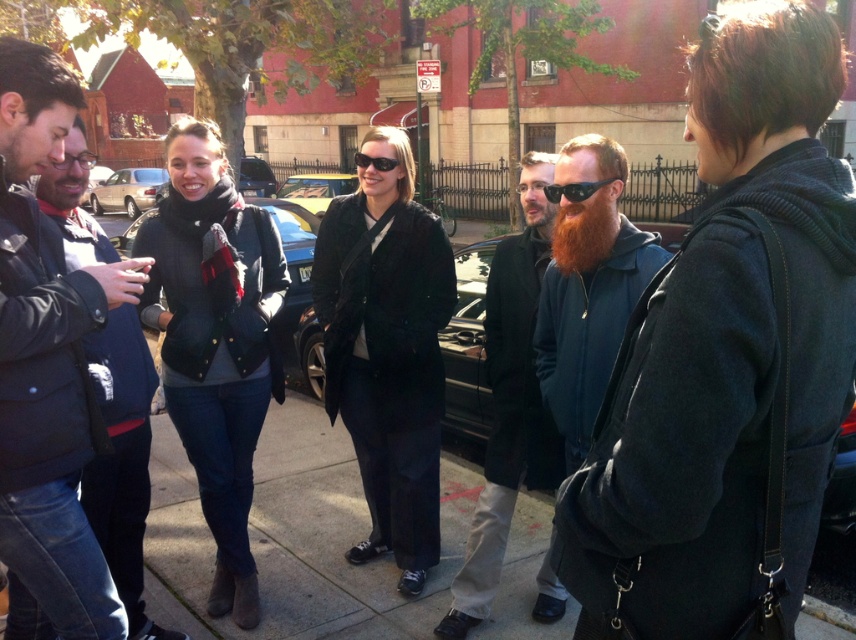
Based on the photo, does gray concrete sidewalk at center have a lesser height compared to matte black coat at center?

Yes, gray concrete sidewalk at center is shorter than matte black coat at center.

Does gray concrete sidewalk at center have a greater height compared to matte black coat at center?

Incorrect, gray concrete sidewalk at center's height is not larger of matte black coat at center's.

I want to click on gray concrete sidewalk at center, so click(x=295, y=538).

Where is `gray concrete sidewalk at center`? This screenshot has height=640, width=856. gray concrete sidewalk at center is located at coordinates (295, 538).

Does leather jacket at center have a lesser width compared to dark blue fleece jacket at center?

Incorrect, leather jacket at center's width is not less than dark blue fleece jacket at center's.

Does leather jacket at center lie behind dark blue fleece jacket at center?

Yes, leather jacket at center is further from the viewer.

Find the location of a particular element. The width and height of the screenshot is (856, 640). leather jacket at center is located at coordinates (215, 340).

Image resolution: width=856 pixels, height=640 pixels. Identify the location of leather jacket at center. (215, 340).

Does point (63, 381) come in front of point (617, 152)?

Yes, point (63, 381) is in front of point (617, 152).

Can you confirm if dark blue puffer jacket at left is positioned to the left of dark blue fleece jacket at center?

Yes, dark blue puffer jacket at left is to the left of dark blue fleece jacket at center.

Does point (1, 141) come behind point (550, 282)?

No, it is not.

The image size is (856, 640). I want to click on dark blue puffer jacket at left, so click(46, 371).